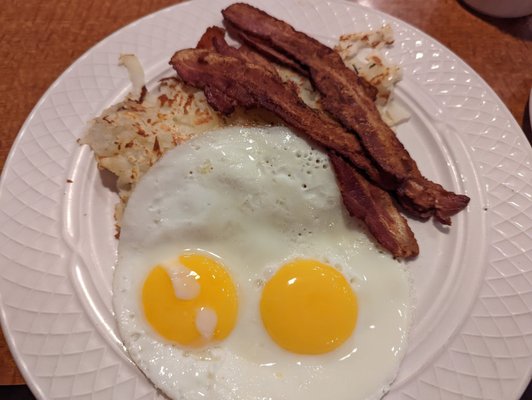
Where is `plate`? The width and height of the screenshot is (532, 400). plate is located at coordinates (492, 311).